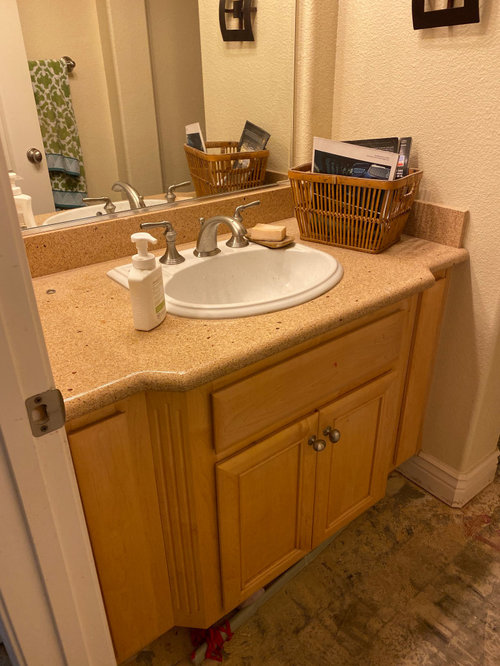
You are a GUI agent. You are given a task and a screenshot of the screen. Output one action in this format:
    pyautogui.click(x=<x>, y=<y>)
    Task: Click on the door handles
    The width and height of the screenshot is (500, 666).
    Given the screenshot: What is the action you would take?
    pyautogui.click(x=321, y=447), pyautogui.click(x=334, y=438)